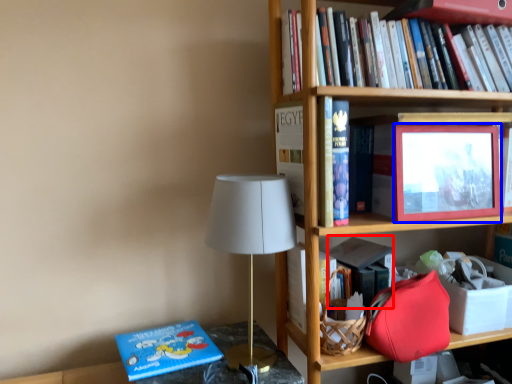
Question: Which object appears farthest to the camera in this image, paperback book (highlighted by a red box) or picture frame (highlighted by a blue box)?

Choices:
 (A) paperback book
 (B) picture frame

Answer: (A)